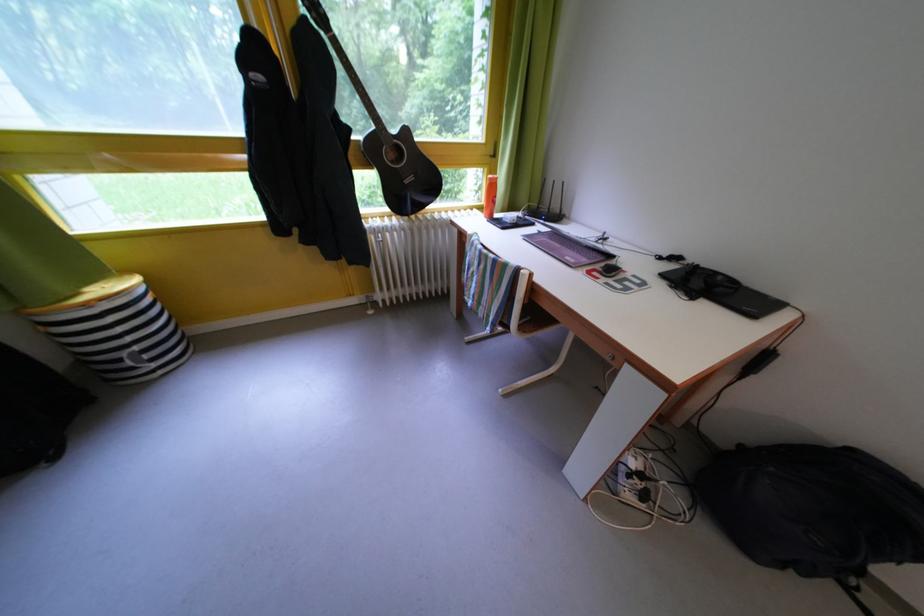
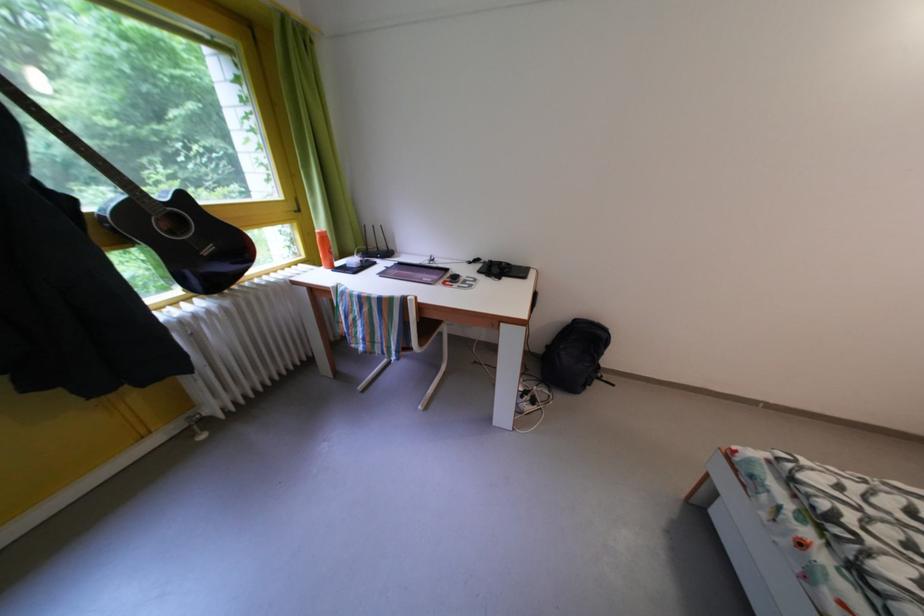
Where in the second image is the point corresponding to (500,185) from the first image?

(329, 238)